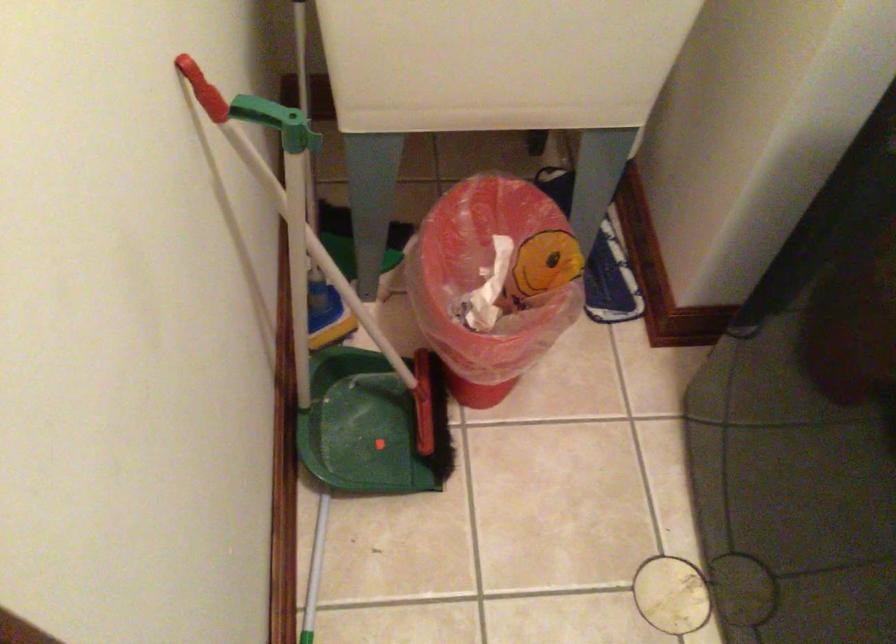
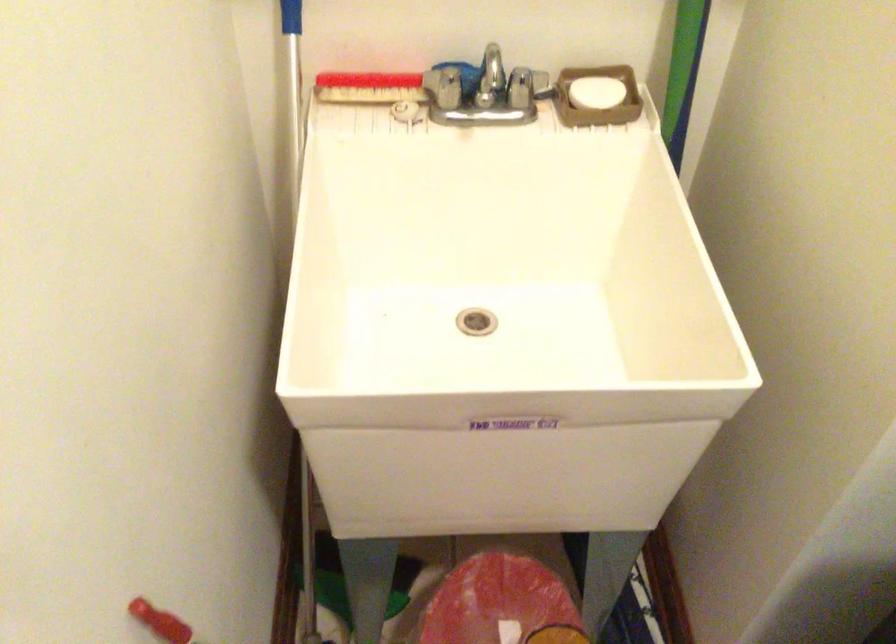
Question: Based on the continuous images, in which direction is the camera rotating? Reply with the corresponding letter.

Choices:
 (A) Left
 (B) Right
 (C) Up
 (D) Down

Answer: (C)